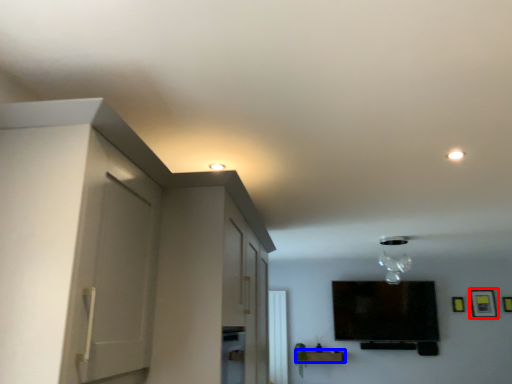
Question: Among these objects, which one is farthest to the camera, picture frame (highlighted by a red box) or furniture (highlighted by a blue box)?

Choices:
 (A) picture frame
 (B) furniture

Answer: (A)